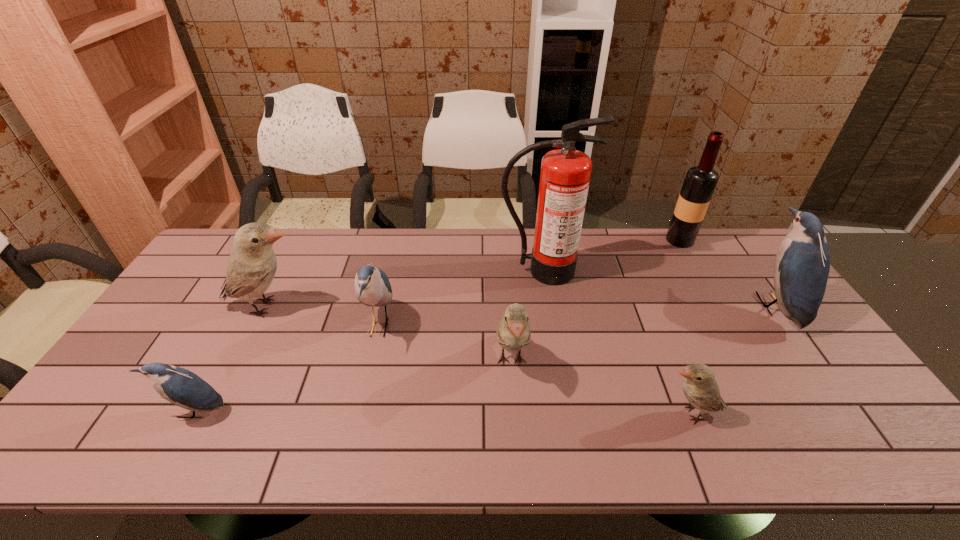
Where is `object that is at the right edge`? The height and width of the screenshot is (540, 960). object that is at the right edge is located at coordinates (802, 264).

In the image, there is a desktop. Where is `free region at the far edge`? free region at the far edge is located at coordinates (366, 249).

The width and height of the screenshot is (960, 540). I want to click on vacant area at the near edge, so click(x=684, y=434).

Where is `vacant space at the right edge`? Image resolution: width=960 pixels, height=540 pixels. vacant space at the right edge is located at coordinates (734, 300).

In the image, there is a desktop. Identify the location of vacant area at the far left corner. (196, 268).

This screenshot has height=540, width=960. In the image, there is a desktop. What are the coordinates of `vacant space at the near left corner` in the screenshot? It's located at 132,426.

Where is `vacant area that lies between the sixth object from right to left and the second white bird from left to right`? The width and height of the screenshot is (960, 540). vacant area that lies between the sixth object from right to left and the second white bird from left to right is located at coordinates (445, 344).

Locate an element on the screen. The width and height of the screenshot is (960, 540). free spot between the seventh shortest object and the smallest blue bird is located at coordinates (437, 326).

Find the location of a particular element. The height and width of the screenshot is (540, 960). vacant point located between the seventh shortest object and the rightmost white bird is located at coordinates (685, 327).

Identify the location of empty location between the second biggest white bird and the nearest blue bird. (353, 387).